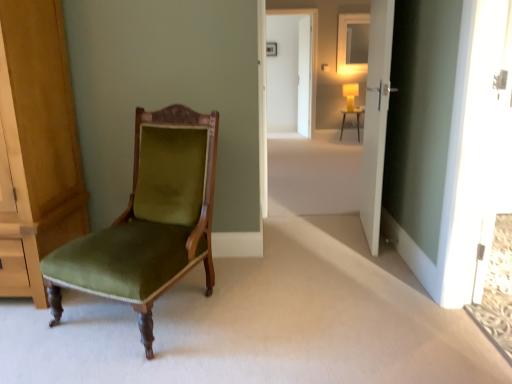
In order to click on vacant space to the right of velvet green chair at left in this screenshot , I will do `click(268, 304)`.